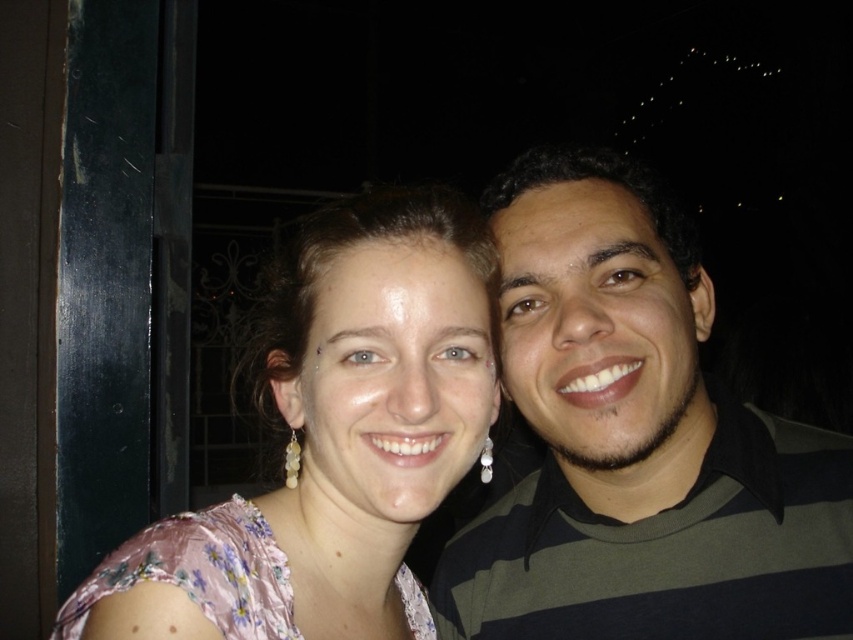
Can you confirm if striped cotton shirt at right is positioned to the left of pink floral dress at center?

No, striped cotton shirt at right is not to the left of pink floral dress at center.

Who is lower down, striped cotton shirt at right or pink floral dress at center?

pink floral dress at center is below.

This screenshot has width=853, height=640. In order to click on striped cotton shirt at right in this screenshot , I will do `click(637, 442)`.